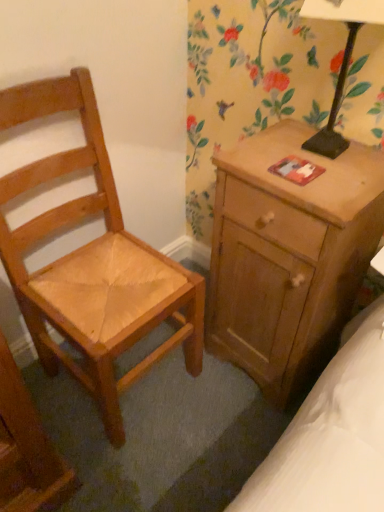
I want to click on vacant space in front of black metal table lamp at upper right, so click(x=335, y=189).